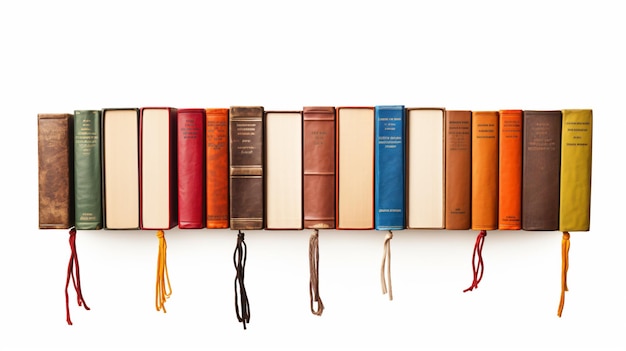
Find the location of a particular element. The height and width of the screenshot is (351, 626). book with spine facing in is located at coordinates (123, 206), (156, 204), (365, 177), (292, 181), (419, 180).